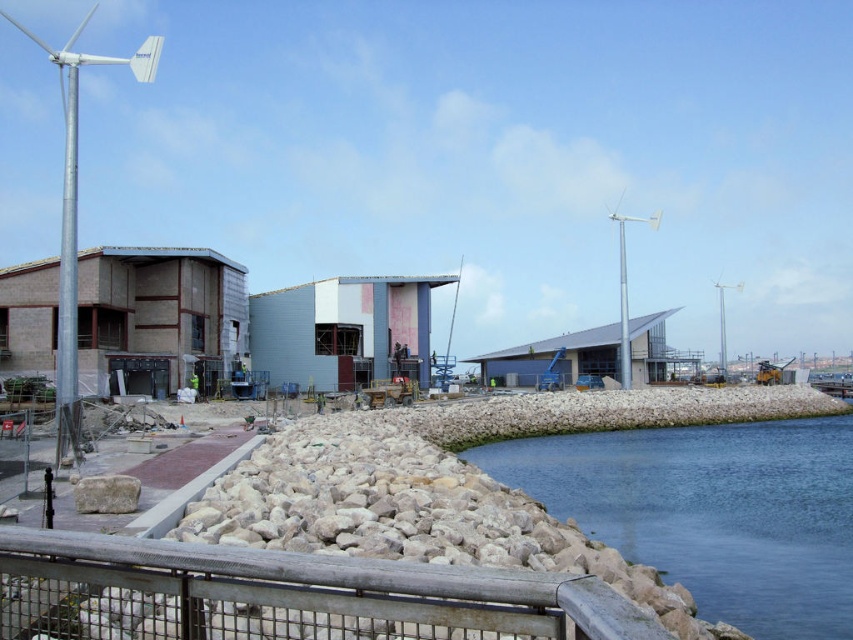
Question: Can you confirm if rustic wood rail at lower center is bigger than silver metallic wind turbine at left?

Choices:
 (A) no
 (B) yes

Answer: (A)

Question: Can you confirm if blue smooth water at lower right is wider than silver metallic wind turbine at left?

Choices:
 (A) yes
 (B) no

Answer: (B)

Question: Which point is farther from the camera taking this photo?

Choices:
 (A) (532, 598)
 (B) (61, 376)
 (C) (611, 477)

Answer: (C)

Question: Which point is closer to the camera taking this photo?

Choices:
 (A) (363, 568)
 (B) (728, 435)
 (C) (65, 232)

Answer: (A)

Question: Among these points, which one is nearest to the camera?

Choices:
 (A) (90, 624)
 (B) (718, 472)

Answer: (A)

Question: Is blue smooth water at lower right further to the viewer compared to silver metallic wind turbine at left?

Choices:
 (A) no
 (B) yes

Answer: (A)